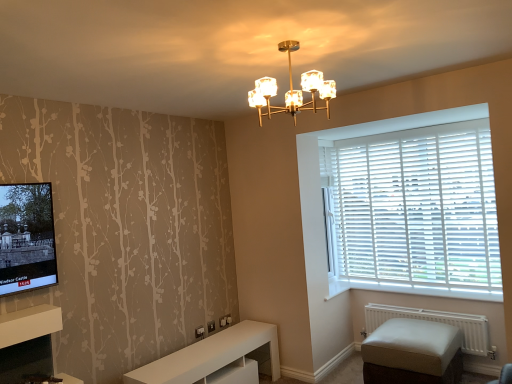
Question: Does beige fabric ottoman at lower right have a smaller size compared to gold metallic chandelier at upper center?

Choices:
 (A) yes
 (B) no

Answer: (B)

Question: Is gold metallic chandelier at upper center at the back of beige fabric ottoman at lower right?

Choices:
 (A) no
 (B) yes

Answer: (A)

Question: Is the depth of beige fabric ottoman at lower right greater than that of gold metallic chandelier at upper center?

Choices:
 (A) yes
 (B) no

Answer: (A)

Question: Is beige fabric ottoman at lower right wider than gold metallic chandelier at upper center?

Choices:
 (A) no
 (B) yes

Answer: (B)

Question: From a real-world perspective, is beige fabric ottoman at lower right positioned over gold metallic chandelier at upper center based on gravity?

Choices:
 (A) yes
 (B) no

Answer: (B)

Question: Considering the positions of white wood at lower right and white matte radiator at lower right in the image, is white wood at lower right wider or thinner than white matte radiator at lower right?

Choices:
 (A) wide
 (B) thin

Answer: (A)

Question: In terms of height, does white wood at lower right look taller or shorter compared to white matte radiator at lower right?

Choices:
 (A) tall
 (B) short

Answer: (B)

Question: From a real-world perspective, is white wood at lower right physically located above or below white matte radiator at lower right?

Choices:
 (A) above
 (B) below

Answer: (A)

Question: Considering the relative positions of white wood at lower right and white matte radiator at lower right in the image provided, is white wood at lower right to the left or to the right of white matte radiator at lower right?

Choices:
 (A) right
 (B) left

Answer: (B)

Question: In terms of size, does white wood at lower right appear bigger or smaller than white matte shelf at lower left?

Choices:
 (A) small
 (B) big

Answer: (B)

Question: From a real-world perspective, is white wood at lower right above or below white matte shelf at lower left?

Choices:
 (A) above
 (B) below

Answer: (B)

Question: Which is correct: white wood at lower right is inside white matte shelf at lower left, or outside of it?

Choices:
 (A) inside
 (B) outside

Answer: (B)

Question: Would you say white wood at lower right is to the left or to the right of white matte shelf at lower left in the picture?

Choices:
 (A) left
 (B) right

Answer: (B)

Question: From a real-world perspective, relative to white matte radiator at lower right, is beige fabric ottoman at lower right vertically above or below?

Choices:
 (A) above
 (B) below

Answer: (B)

Question: Does point (431, 329) appear closer or farther from the camera than point (461, 314)?

Choices:
 (A) closer
 (B) farther

Answer: (A)